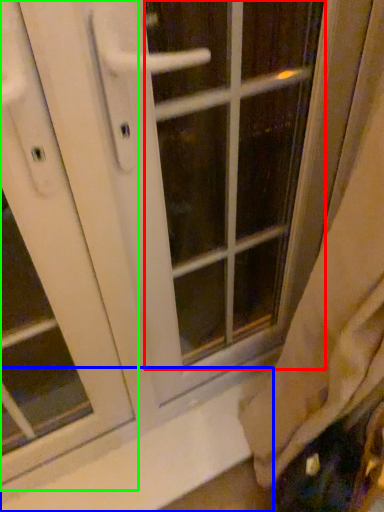
Question: Which is nearer to the glass door (highlighted by a red box)? window sill (highlighted by a blue box) or screen door (highlighted by a green box).

Choices:
 (A) window sill
 (B) screen door

Answer: (A)